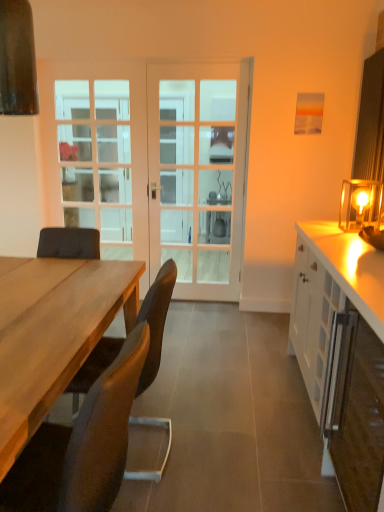
Question: Is brown leather chair at lower left, acting as the 2th chair starting from the back, taller than matte glass table lamp at right?

Choices:
 (A) yes
 (B) no

Answer: (A)

Question: From a real-world perspective, is brown leather chair at lower left, acting as the 2th chair starting from the back, on matte glass table lamp at right?

Choices:
 (A) yes
 (B) no

Answer: (B)

Question: From a real-world perspective, is brown leather chair at lower left, acting as the 2th chair starting from the back, below matte glass table lamp at right?

Choices:
 (A) yes
 (B) no

Answer: (A)

Question: Is brown leather chair at lower left, acting as the 2th chair starting from the back, facing towards matte glass table lamp at right?

Choices:
 (A) no
 (B) yes

Answer: (A)

Question: Are brown leather chair at lower left, acting as the 2th chair starting from the back, and matte glass table lamp at right located far from each other?

Choices:
 (A) yes
 (B) no

Answer: (A)

Question: Does brown leather chair at lower left, placed as the 1th chair when sorted from front to back, lie behind matte glass table lamp at right?

Choices:
 (A) yes
 (B) no

Answer: (B)

Question: Is brown leather chair at lower left, which is the second chair in front-to-back order, positioned in front of clear glass door at center?

Choices:
 (A) yes
 (B) no

Answer: (A)

Question: Is brown leather chair at lower left, the first chair positioned from the back, behind clear glass door at center?

Choices:
 (A) no
 (B) yes

Answer: (A)

Question: Considering the relative sizes of brown leather chair at lower left, which is the second chair in front-to-back order, and clear glass door at center in the image provided, is brown leather chair at lower left, which is the second chair in front-to-back order, thinner than clear glass door at center?

Choices:
 (A) no
 (B) yes

Answer: (A)

Question: From a real-world perspective, is brown leather chair at lower left, the first chair positioned from the back, beneath clear glass door at center?

Choices:
 (A) yes
 (B) no

Answer: (A)

Question: Is brown leather chair at lower left, which is the second chair in front-to-back order, with clear glass door at center?

Choices:
 (A) no
 (B) yes

Answer: (A)

Question: Is brown leather chair at lower left, which is the second chair in front-to-back order, not within clear glass door at center?

Choices:
 (A) yes
 (B) no

Answer: (A)

Question: Is white glass screen door at center taller than brown leather chair at lower left, which is the second chair in front-to-back order?

Choices:
 (A) no
 (B) yes

Answer: (B)